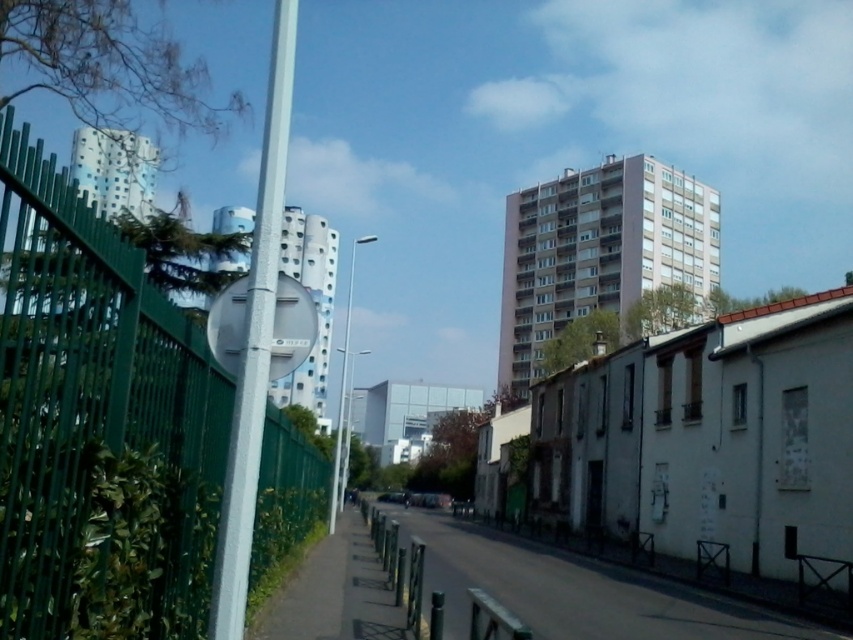
Question: Which is farther from the metallic pole at left?

Choices:
 (A) metallic pole at center
 (B) green metal fence at left
 (C) smooth concrete alley at center
 (D) white metallic sign at center-left

Answer: (A)

Question: Considering the real-world distances, which object is farthest from the green metal fence at left?

Choices:
 (A) white metallic sign at center-left
 (B) metallic pole at center
 (C) smooth concrete alley at center
 (D) metallic pole at left

Answer: (B)

Question: Can you confirm if metallic pole at left is bigger than white metallic sign at center-left?

Choices:
 (A) yes
 (B) no

Answer: (A)

Question: Among these points, which one is nearest to the camera?

Choices:
 (A) (215, 352)
 (B) (805, 634)

Answer: (A)

Question: Does smooth concrete alley at center appear on the right side of metallic pole at left?

Choices:
 (A) no
 (B) yes

Answer: (B)

Question: Can you confirm if metallic pole at left is positioned above white metallic sign at center-left?

Choices:
 (A) no
 (B) yes

Answer: (B)